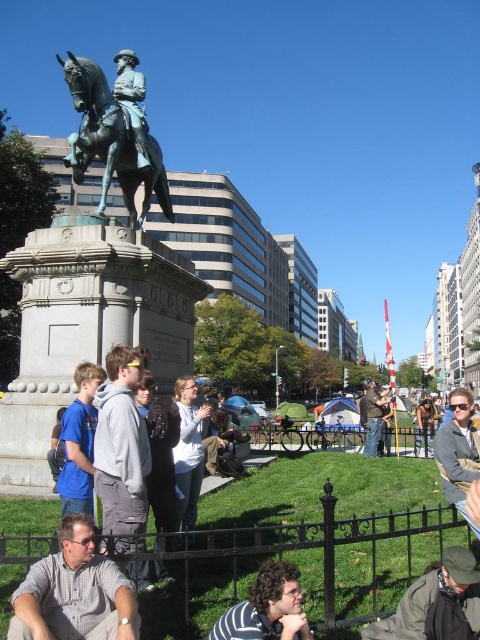
Question: From the image, what is the correct spatial relationship of bronze statue at center in relation to blue cotton shirt at lower left?

Choices:
 (A) below
 (B) above

Answer: (B)

Question: Is green grass at lower center to the right of dark gray fabric at lower right from the viewer's perspective?

Choices:
 (A) yes
 (B) no

Answer: (B)

Question: Observing the image, what is the correct spatial positioning of polished bronze statue at center in reference to camouflage jacket at center?

Choices:
 (A) below
 (B) above

Answer: (B)

Question: Estimate the real-world distances between objects in this image. Which object is closer to the camouflage jacket at center?

Choices:
 (A) polished bronze statue at center
 (B) gray knit sweater at lower right

Answer: (B)

Question: Estimate the real-world distances between objects in this image. Which object is closer to the gray cotton shirt at lower left?

Choices:
 (A) gray knit sweater at lower right
 (B) camouflage jacket at center
 (C) polished bronze statue at center

Answer: (A)

Question: Considering the real-world distances, which object is closest to the polished bronze statue at center?

Choices:
 (A) dark gray fabric at lower right
 (B) gray cotton shirt at lower left

Answer: (B)